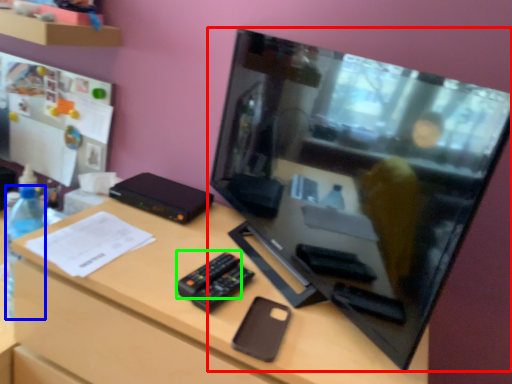
Question: Based on their relative distances, which object is nearer to television (highlighted by a red box)? Choose from bottle (highlighted by a blue box) and remote (highlighted by a green box).

Choices:
 (A) bottle
 (B) remote

Answer: (B)